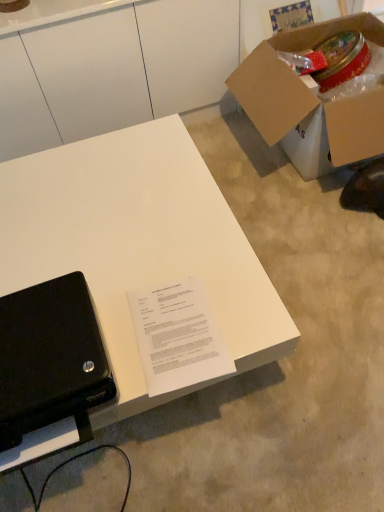
Find the location of a particular element. free space behind white paper at center is located at coordinates (168, 254).